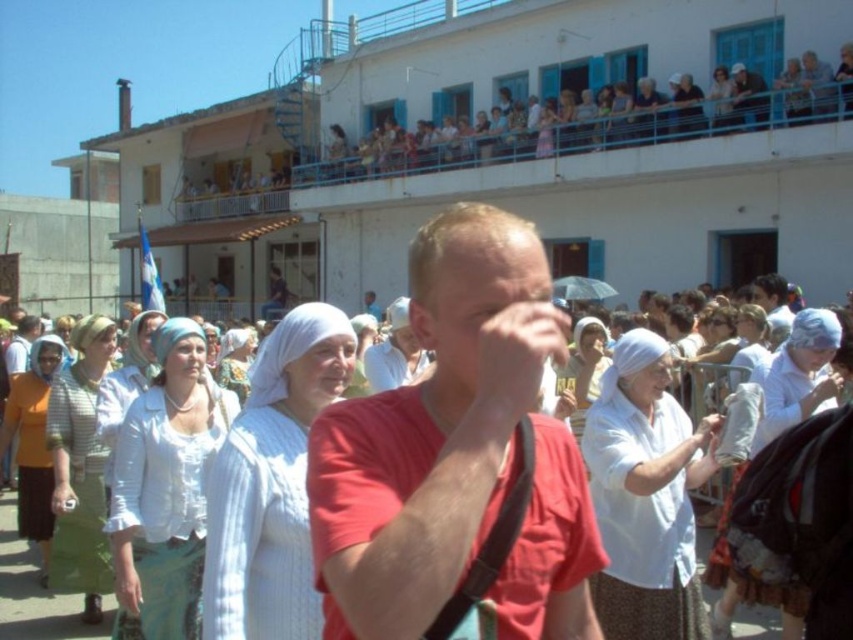
Does red matte shirt at center have a lesser width compared to white cloth-covered heads at upper center?

Yes.

Measure the distance between red matte shirt at center and white cloth-covered heads at upper center.

They are 25.09 meters apart.

Between point (534, 323) and point (442, 157), which one is positioned in front?

Point (534, 323) is more forward.

This screenshot has width=853, height=640. I want to click on red matte shirt at center, so click(456, 452).